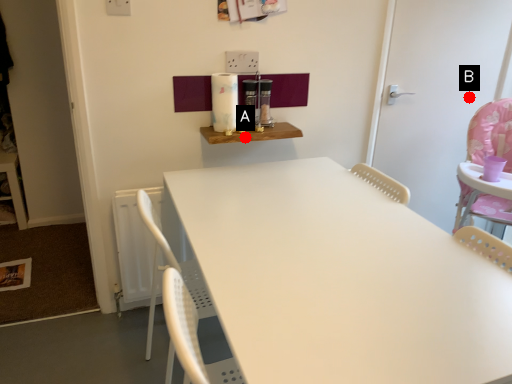
Question: Two points are circled on the image, labeled by A and B beside each circle. Which point is closer to the camera?

Choices:
 (A) A is closer
 (B) B is closer

Answer: (A)